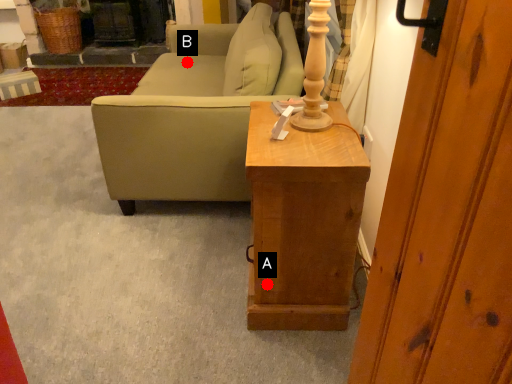
Question: Two points are circled on the image, labeled by A and B beside each circle. Which of the following is the farthest from the observer?

Choices:
 (A) A is further
 (B) B is further

Answer: (B)